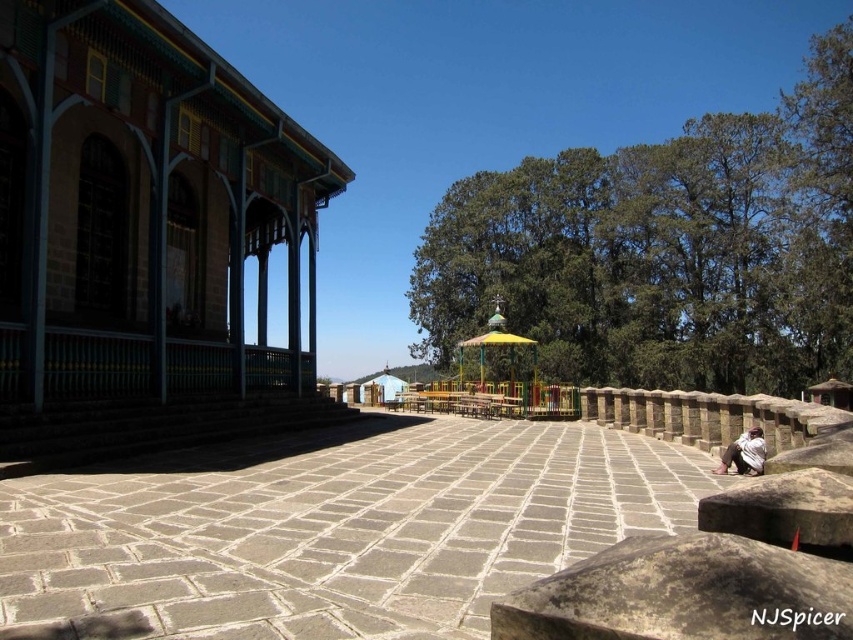
Between green leafy tree at center and yellow painted wood gazebo at center, which one has more height?

green leafy tree at center

The width and height of the screenshot is (853, 640). Find the location of `green leafy tree at center`. green leafy tree at center is located at coordinates [x=665, y=250].

Find the location of a particular element. The image size is (853, 640). green leafy tree at center is located at coordinates (665, 250).

Which is in front, point (747, 461) or point (534, 360)?

Positioned in front is point (747, 461).

Image resolution: width=853 pixels, height=640 pixels. Describe the element at coordinates (744, 452) in the screenshot. I see `white cotton shirt at lower right` at that location.

This screenshot has height=640, width=853. I want to click on white cotton shirt at lower right, so click(744, 452).

Between green leafy tree at center and white cotton shirt at lower right, which one is positioned higher?

green leafy tree at center is above.

Between point (685, 230) and point (756, 435), which one is positioned in front?

Positioned in front is point (756, 435).

Where is `green leafy tree at center`? The image size is (853, 640). green leafy tree at center is located at coordinates (665, 250).